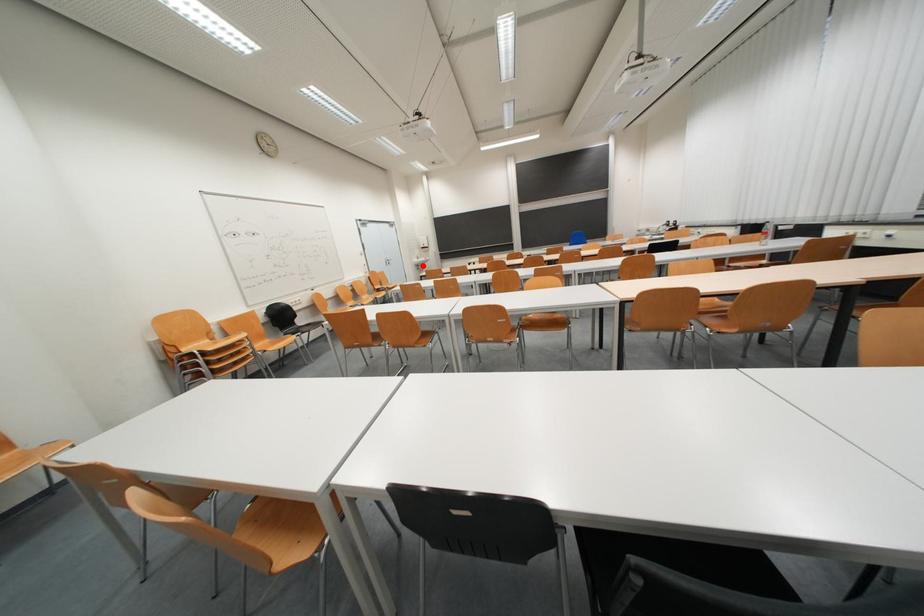
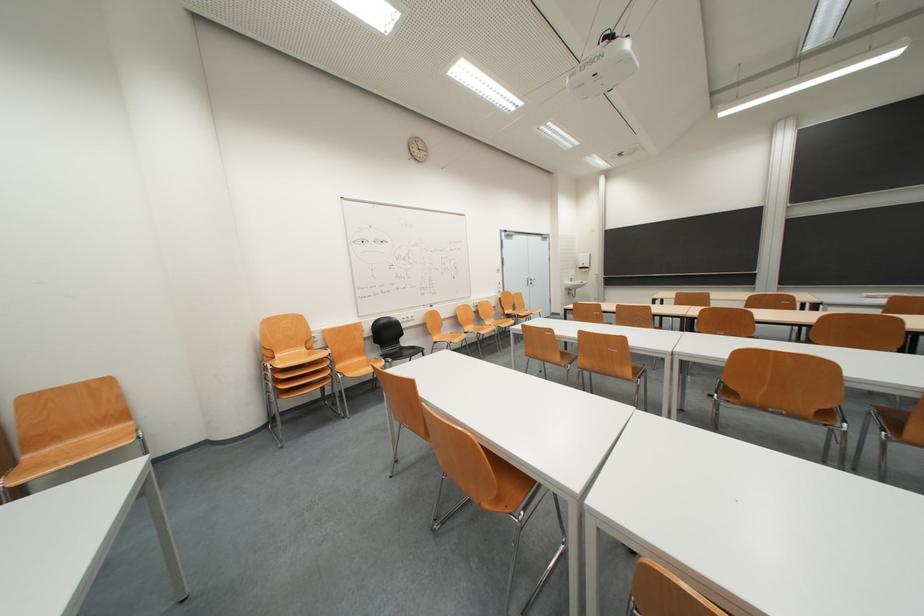
Find the pixel in the second image that matches the highlighted location in the first image.

(575, 288)